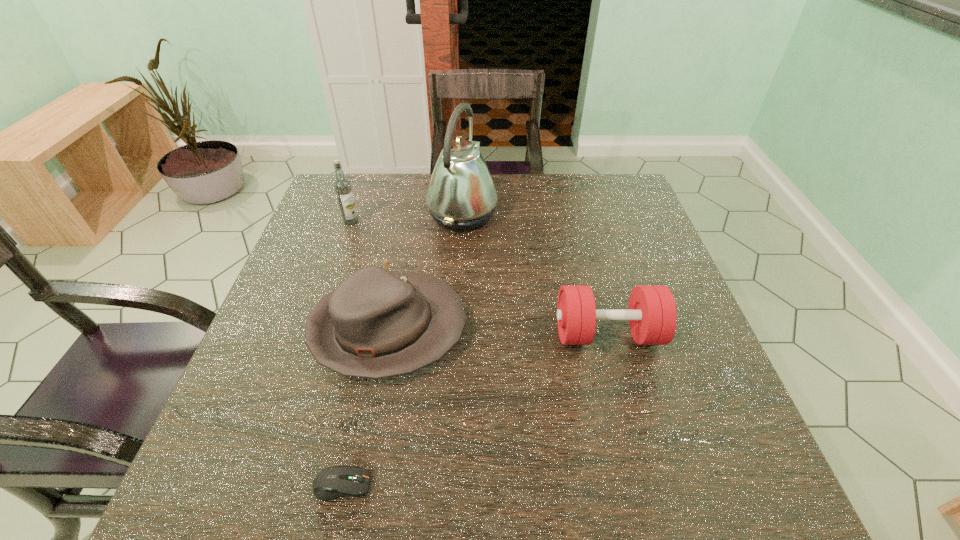
You are a GUI agent. You are given a task and a screenshot of the screen. Output one action in this format:
    pyautogui.click(x=<x>, y=<y>)
    Task: Click on the kettle
    This screenshot has height=540, width=960.
    Given the screenshot: What is the action you would take?
    pyautogui.click(x=461, y=195)

In order to click on vodka in this screenshot , I will do `click(342, 186)`.

Image resolution: width=960 pixels, height=540 pixels. In order to click on hat in this screenshot , I will do `click(376, 324)`.

Identify the location of dumbbell. (652, 315).

Where is `the nearest object`? The height and width of the screenshot is (540, 960). the nearest object is located at coordinates (333, 482).

Image resolution: width=960 pixels, height=540 pixels. I want to click on computer equipment, so click(333, 482).

The height and width of the screenshot is (540, 960). Identify the location of vacant area situated on the left of the tallest object. (410, 213).

Image resolution: width=960 pixels, height=540 pixels. In order to click on free space located 0.060m on the label of the vodka in this screenshot , I will do `click(345, 240)`.

Image resolution: width=960 pixels, height=540 pixels. In order to click on vacant position located 0.200m on the decorative side of the hat in this screenshot , I will do `click(560, 329)`.

Where is `vacant point located on the front of the rightmost object`? The width and height of the screenshot is (960, 540). vacant point located on the front of the rightmost object is located at coordinates (629, 416).